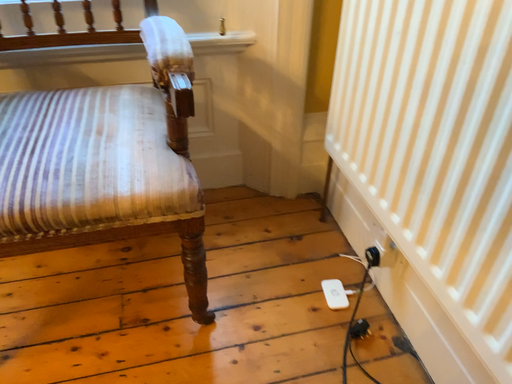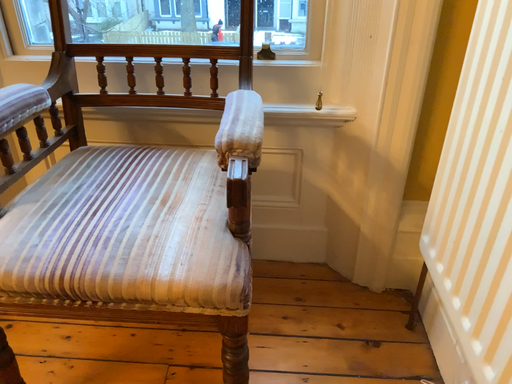
Question: Which way did the camera rotate in the video?

Choices:
 (A) rotated right
 (B) rotated left

Answer: (B)